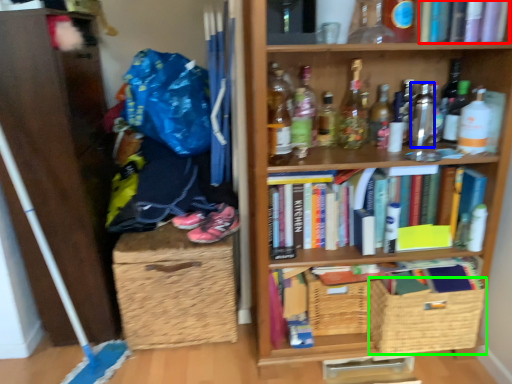
Question: Which is nearer to the book (highlighted by a red box)? bottle (highlighted by a blue box) or basket (highlighted by a green box).

Choices:
 (A) bottle
 (B) basket

Answer: (A)